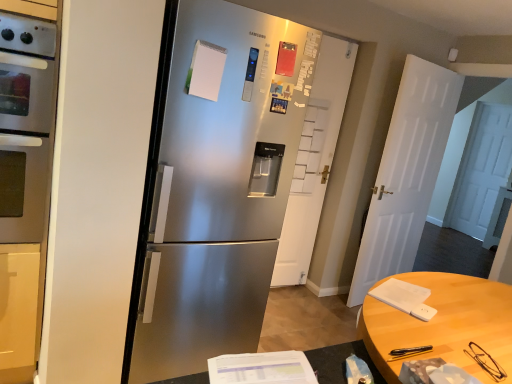
Question: Is satin silver oven at left taller than white matte door at center, the 1th door positioned from the left?

Choices:
 (A) no
 (B) yes

Answer: (A)

Question: Is satin silver oven at left behind white matte door at center, the 2th door in the right-to-left sequence?

Choices:
 (A) yes
 (B) no

Answer: (B)

Question: Can you confirm if satin silver oven at left is smaller than white matte door at center, the 1th door positioned from the left?

Choices:
 (A) yes
 (B) no

Answer: (B)

Question: Is satin silver oven at left positioned with its back to white matte door at center, the 2th door in the right-to-left sequence?

Choices:
 (A) no
 (B) yes

Answer: (A)

Question: From the image's perspective, is satin silver oven at left on top of white matte door at center, the 1th door positioned from the left?

Choices:
 (A) yes
 (B) no

Answer: (A)

Question: Is satin silver oven at left bigger than white matte door at center, the 2th door in the right-to-left sequence?

Choices:
 (A) no
 (B) yes

Answer: (B)

Question: Does white matte door at center, the 1th door positioned from the left, come behind satin silver refrigerator at center?

Choices:
 (A) no
 (B) yes

Answer: (B)

Question: Is white matte door at center, the 1th door positioned from the left, directly adjacent to satin silver refrigerator at center?

Choices:
 (A) yes
 (B) no

Answer: (B)

Question: Can you confirm if white matte door at center, the 2th door in the right-to-left sequence, is positioned to the left of satin silver refrigerator at center?

Choices:
 (A) yes
 (B) no

Answer: (B)

Question: Considering the relative sizes of white matte door at center, the 2th door in the right-to-left sequence, and satin silver refrigerator at center in the image provided, is white matte door at center, the 2th door in the right-to-left sequence, bigger than satin silver refrigerator at center?

Choices:
 (A) yes
 (B) no

Answer: (B)

Question: From the image's perspective, is white matte door at center, the 2th door in the right-to-left sequence, over satin silver refrigerator at center?

Choices:
 (A) yes
 (B) no

Answer: (A)

Question: From the image's perspective, is white matte door at center, the 1th door positioned from the left, below satin silver refrigerator at center?

Choices:
 (A) no
 (B) yes

Answer: (A)

Question: Is satin silver refrigerator at center not within white matte door at center, which is counted as the first door, starting from the right?

Choices:
 (A) no
 (B) yes

Answer: (B)